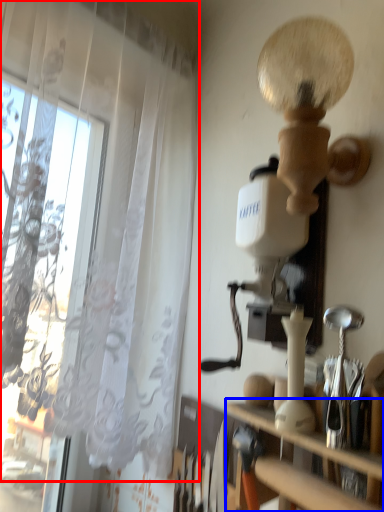
Question: Which of the following is the closest to the observer, curtain (highlighted by a red box) or shelf (highlighted by a blue box)?

Choices:
 (A) curtain
 (B) shelf

Answer: (B)